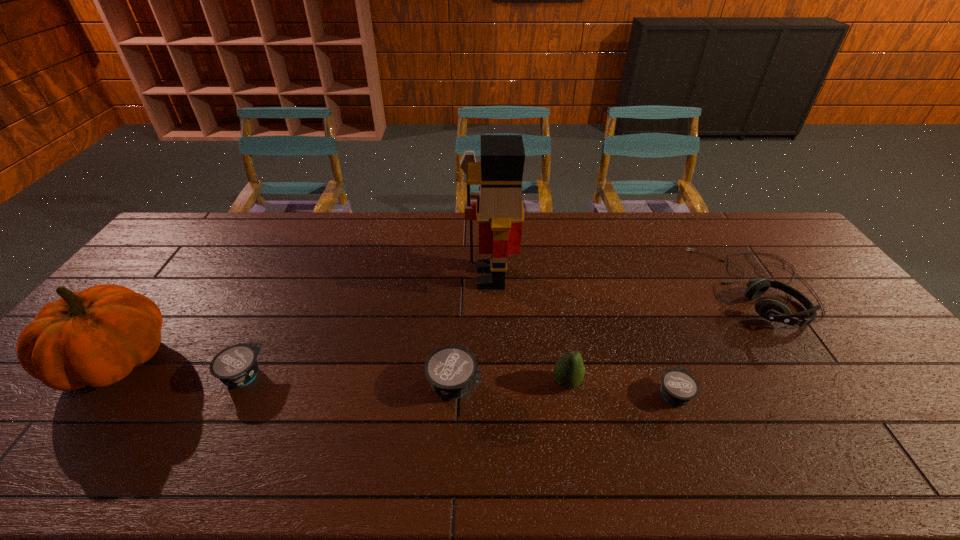
At what (x,y) coordinates should I click in order to perform the action: click on vacant space located on the outer surface of the rightmost object. Please return your answer as a coordinate pair (x, y). The height and width of the screenshot is (540, 960). Looking at the image, I should click on (630, 287).

You are a GUI agent. You are given a task and a screenshot of the screen. Output one action in this format:
    pyautogui.click(x=<x>, y=<y>)
    Task: Click on the vacant space located 0.100m on the outer surface of the rightmost object
    The image size is (960, 540).
    Given the screenshot: What is the action you would take?
    pyautogui.click(x=675, y=287)

Image resolution: width=960 pixels, height=540 pixels. What are the coordinates of `object that is positioned at the far edge` in the screenshot? It's located at (770, 308).

Image resolution: width=960 pixels, height=540 pixels. I want to click on avocado present at the near edge, so click(x=569, y=370).

Where is `pumpkin located in the near edge section of the desktop`? This screenshot has width=960, height=540. pumpkin located in the near edge section of the desktop is located at coordinates (95, 337).

Image resolution: width=960 pixels, height=540 pixels. Find the location of `object that is at the left edge`. object that is at the left edge is located at coordinates (95, 337).

The width and height of the screenshot is (960, 540). I want to click on object located in the right edge section of the desktop, so click(x=770, y=308).

Identify the location of object positioned at the near left corner. (95, 337).

Identify the location of object that is at the far right corner. Image resolution: width=960 pixels, height=540 pixels. (770, 308).

In the image, there is a desktop. At what (x,y) coordinates should I click in order to perform the action: click on free space at the far edge. Please return your answer as a coordinate pair (x, y). The width and height of the screenshot is (960, 540). Looking at the image, I should click on (430, 235).